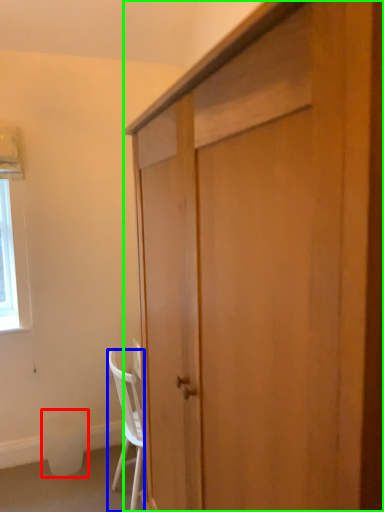
Question: Estimate the real-world distances between objects in this image. Which object is closer to trash bin/can (highlighted by a red box), chair (highlighted by a blue box) or cabinetry (highlighted by a green box)?

Choices:
 (A) chair
 (B) cabinetry

Answer: (A)